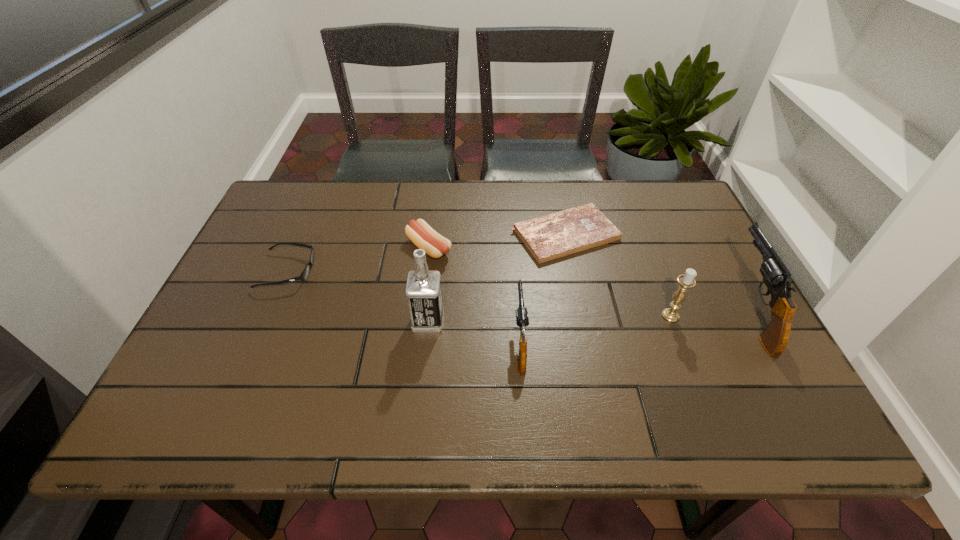
Image resolution: width=960 pixels, height=540 pixels. What are the coordinates of `the left gun` in the screenshot? It's located at (522, 320).

Identify the location of the fourth shortest object. The image size is (960, 540). (522, 320).

Where is `the right gun`? This screenshot has width=960, height=540. the right gun is located at coordinates (776, 276).

In order to click on the rightmost object in this screenshot , I will do `click(776, 276)`.

This screenshot has width=960, height=540. Find the location of `Bible`. Bible is located at coordinates (549, 237).

You are a GUI agent. You are given a task and a screenshot of the screen. Output one action in this format:
    pyautogui.click(x=<x>, y=<y>)
    Task: Click on the leftmost object
    
    Given the screenshot: What is the action you would take?
    pyautogui.click(x=304, y=275)

What are the coordinates of `sunglasses` in the screenshot? It's located at (304, 275).

Identify the location of the third shortest object. (419, 232).

Image resolution: width=960 pixels, height=540 pixels. I want to click on the tallest object, so (x=423, y=290).

You are a GUI agent. You are given a task and a screenshot of the screen. Output one action in this format:
    pyautogui.click(x=<x>, y=<y>)
    Task: Click on the second object from right to left
    
    Given the screenshot: What is the action you would take?
    pyautogui.click(x=686, y=281)